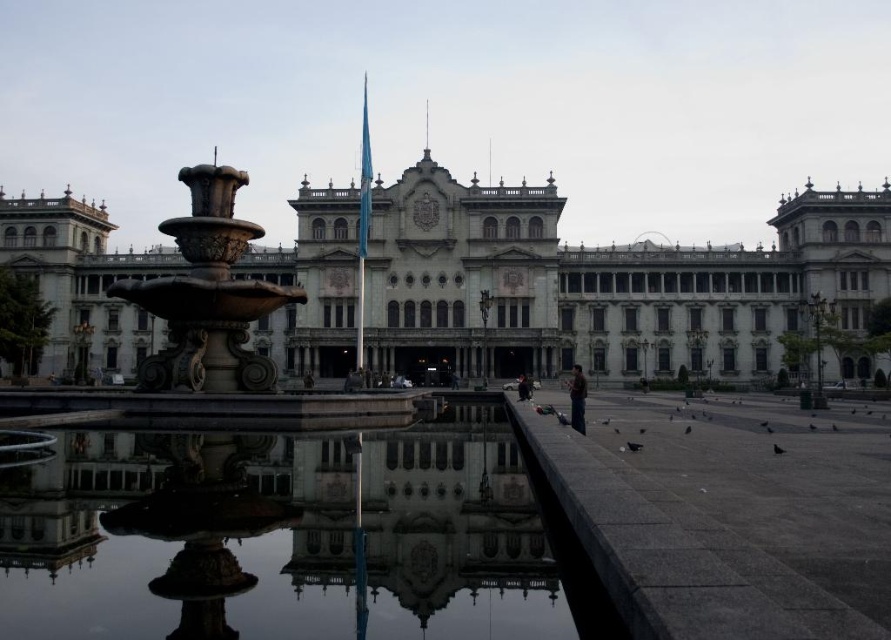
Can you confirm if stone fountain at center is wider than reflective glass water at center?

Yes, stone fountain at center is wider than reflective glass water at center.

Find the location of a particular element. stone fountain at center is located at coordinates (281, 524).

Who is more forward, (332,593) or (797,317)?

Point (332,593) is more forward.

Based on the photo, can you confirm if stone fountain at center is shorter than stone building at center?

No.

Is point (170, 452) less distant than point (391, 365)?

Yes, point (170, 452) is in front of point (391, 365).

Locate an element on the screen. The image size is (891, 640). stone fountain at center is located at coordinates (281, 524).

Who is positioned more to the left, stone building at center or reflective glass water at center?

reflective glass water at center is more to the left.

Looking at this image, between stone building at center and reflective glass water at center, which one has more height?

stone building at center is taller.

Between point (293, 348) and point (485, 513), which one is positioned in front?

Point (485, 513) is more forward.

In order to click on stone building at center in this screenshot , I will do coord(612,285).